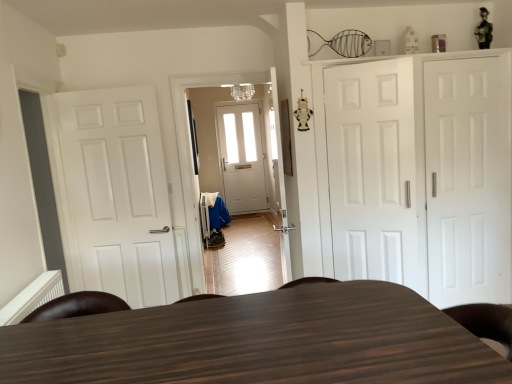
Find the location of a particular element. The width and height of the screenshot is (512, 384). free location above white matte door at right, the 1th door viewed from the right (from a real-world perspective) is located at coordinates (463, 56).